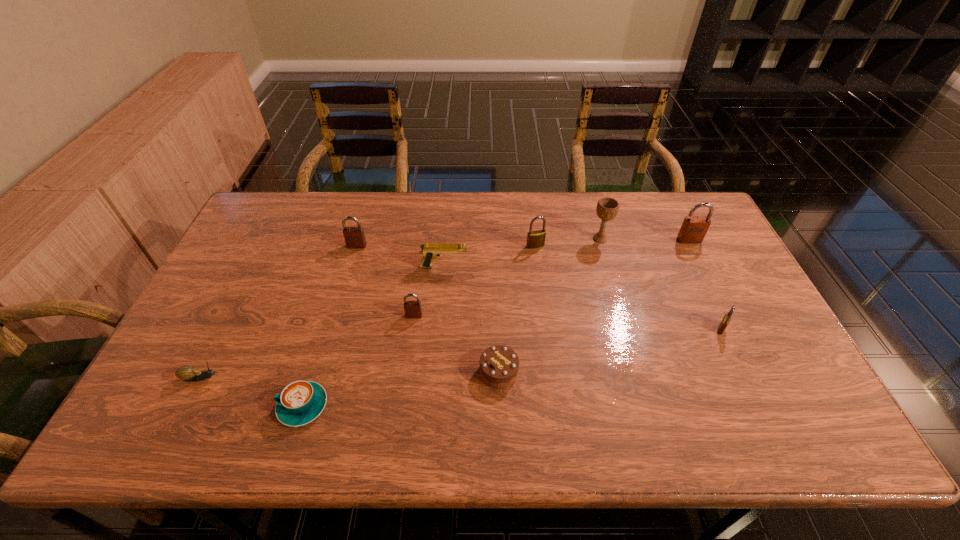
Locate an element on the screen. The height and width of the screenshot is (540, 960). the smaller brass padlock is located at coordinates (725, 321).

In order to click on the fourth nearest object in this screenshot , I will do `click(725, 321)`.

At what (x,y) coordinates should I click in order to perform the action: click on the fourth farthest padlock. Please return your answer as a coordinate pair (x, y). Image resolution: width=960 pixels, height=540 pixels. Looking at the image, I should click on (413, 309).

The width and height of the screenshot is (960, 540). In order to click on the sixth farthest object in this screenshot , I will do [413, 309].

Find the location of a particular element. brown chocolate cake is located at coordinates (499, 365).

The width and height of the screenshot is (960, 540). What are the coordinates of `the third shortest object` in the screenshot? It's located at (499, 365).

The width and height of the screenshot is (960, 540). Identify the location of turquoise cappuccino. (300, 402).

The width and height of the screenshot is (960, 540). Find the location of `the leftmost object`. the leftmost object is located at coordinates (189, 373).

Where is `vacant space situated on the front-facing side of the biggest brown padlock`? This screenshot has height=540, width=960. vacant space situated on the front-facing side of the biggest brown padlock is located at coordinates (724, 310).

In order to click on free space located 0.120m on the right of the beige chalice in this screenshot , I will do `click(647, 239)`.